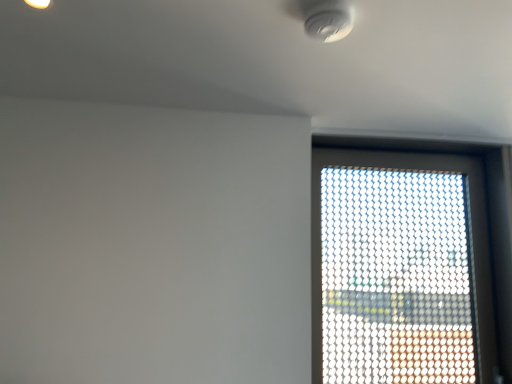
This screenshot has width=512, height=384. In order to click on transparent mesh window at upper right in this screenshot , I will do `click(400, 269)`.

This screenshot has width=512, height=384. Describe the element at coordinates (400, 269) in the screenshot. I see `transparent mesh window at upper right` at that location.

Image resolution: width=512 pixels, height=384 pixels. In order to click on white plastic smoke detector at upper center in this screenshot , I will do `click(327, 19)`.

This screenshot has height=384, width=512. Describe the element at coordinates (327, 19) in the screenshot. I see `white plastic smoke detector at upper center` at that location.

Image resolution: width=512 pixels, height=384 pixels. I want to click on transparent mesh window at upper right, so click(x=400, y=269).

Between transparent mesh window at upper right and white plastic smoke detector at upper center, which one appears on the right side from the viewer's perspective?

transparent mesh window at upper right is more to the right.

Is transparent mesh window at upper right in front of or behind white plastic smoke detector at upper center in the image?

transparent mesh window at upper right is behind white plastic smoke detector at upper center.

Is point (455, 321) in front of point (348, 20)?

No.

From the image's perspective, is transparent mesh window at upper right beneath white plastic smoke detector at upper center?

Yes, from the image's perspective, transparent mesh window at upper right is below white plastic smoke detector at upper center.

From a real-world perspective, is transparent mesh window at upper right physically located above or below white plastic smoke detector at upper center?

In terms of real-world spatial position, transparent mesh window at upper right is below white plastic smoke detector at upper center.

Between transparent mesh window at upper right and white plastic smoke detector at upper center, which one has smaller width?

With smaller width is transparent mesh window at upper right.

Between transparent mesh window at upper right and white plastic smoke detector at upper center, which one has less height?

white plastic smoke detector at upper center.

Considering the sizes of objects transparent mesh window at upper right and white plastic smoke detector at upper center in the image provided, who is bigger, transparent mesh window at upper right or white plastic smoke detector at upper center?

→ With larger size is transparent mesh window at upper right.

Is transparent mesh window at upper right not inside white plastic smoke detector at upper center?

Indeed, transparent mesh window at upper right is completely outside white plastic smoke detector at upper center.

Consider the image. Is transparent mesh window at upper right far away from white plastic smoke detector at upper center?

transparent mesh window at upper right is far away from white plastic smoke detector at upper center.

Is transparent mesh window at upper right oriented towards white plastic smoke detector at upper center?

Yes.

What's the angular difference between transparent mesh window at upper right and white plastic smoke detector at upper center's facing directions?

They differ by 3.01 degrees in their facing directions.

In the image, there is a white plastic smoke detector at upper center. In order to click on window below it (from the image's perspective) in this screenshot , I will do `click(400, 269)`.

Considering the positions of objects white plastic smoke detector at upper center and transparent mesh window at upper right in the image provided, who is more to the left, white plastic smoke detector at upper center or transparent mesh window at upper right?

white plastic smoke detector at upper center is more to the left.

Considering the relative positions of white plastic smoke detector at upper center and transparent mesh window at upper right in the image provided, is white plastic smoke detector at upper center behind transparent mesh window at upper right?

No, it is not.

Consider the image. Which is farther, (336, 25) or (394, 373)?

The point (394, 373) is behind.

From the image's perspective, would you say white plastic smoke detector at upper center is positioned over transparent mesh window at upper right?

Yes, from the image's perspective, white plastic smoke detector at upper center is on top of transparent mesh window at upper right.

From a real-world perspective, is white plastic smoke detector at upper center over transparent mesh window at upper right?

Correct, in the physical world, white plastic smoke detector at upper center is higher than transparent mesh window at upper right.

Is white plastic smoke detector at upper center wider or thinner than transparent mesh window at upper right?

Considering their sizes, white plastic smoke detector at upper center looks broader than transparent mesh window at upper right.

In terms of height, does white plastic smoke detector at upper center look taller or shorter compared to transparent mesh window at upper right?

Clearly, white plastic smoke detector at upper center is shorter compared to transparent mesh window at upper right.

Can you confirm if white plastic smoke detector at upper center is smaller than transparent mesh window at upper right?

Indeed, white plastic smoke detector at upper center has a smaller size compared to transparent mesh window at upper right.

Is white plastic smoke detector at upper center inside the boundaries of transparent mesh window at upper right, or outside?

white plastic smoke detector at upper center cannot be found inside transparent mesh window at upper right.

Is white plastic smoke detector at upper center next to transparent mesh window at upper right and touching it?

No, white plastic smoke detector at upper center is not touching transparent mesh window at upper right.

Is white plastic smoke detector at upper center turned away from transparent mesh window at upper right?

No, white plastic smoke detector at upper center is not facing away from transparent mesh window at upper right.

Can you tell me how much white plastic smoke detector at upper center and transparent mesh window at upper right differ in facing direction?

white plastic smoke detector at upper center and transparent mesh window at upper right are facing 3.01 degrees away from each other.

In order to click on light fixture above the transparent mesh window at upper right (from the image's perspective) in this screenshot , I will do `click(327, 19)`.

Where is `light fixture to the left of transparent mesh window at upper right`? The height and width of the screenshot is (384, 512). light fixture to the left of transparent mesh window at upper right is located at coordinates click(x=327, y=19).

Where is `light fixture in front of the transparent mesh window at upper right`? This screenshot has height=384, width=512. light fixture in front of the transparent mesh window at upper right is located at coordinates (327, 19).